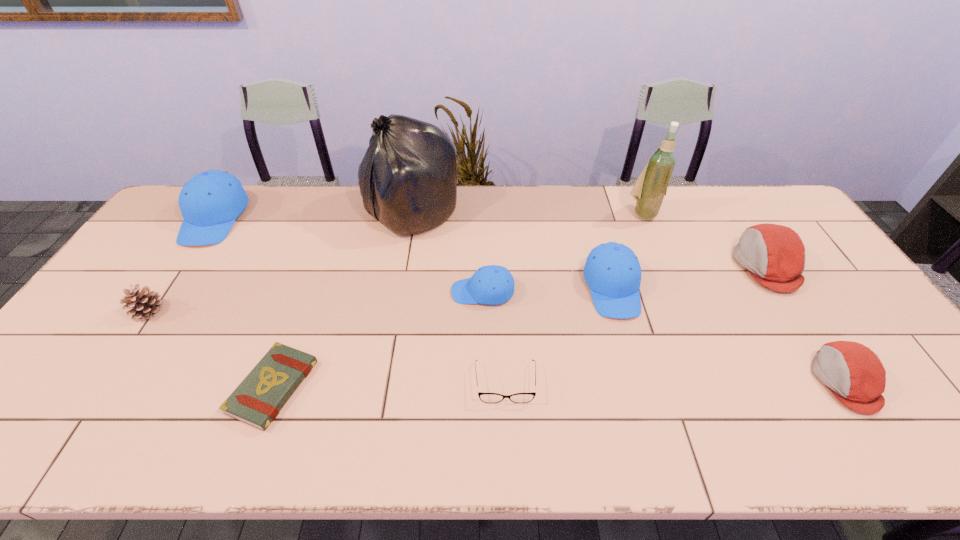
Locate an element on the screen. This screenshot has width=960, height=540. vacant area in the image that satisfies the following two spatial constraints: 1. on the front-facing side of the third cap from left to right; 2. on the front-facing side of the smallest blue cap is located at coordinates (613, 292).

Where is `free point that satisfies the following two spatial constraints: 1. on the front-facing side of the farther red cap; 2. on the front-facing side of the third cap from right to left`? free point that satisfies the following two spatial constraints: 1. on the front-facing side of the farther red cap; 2. on the front-facing side of the third cap from right to left is located at coordinates (780, 288).